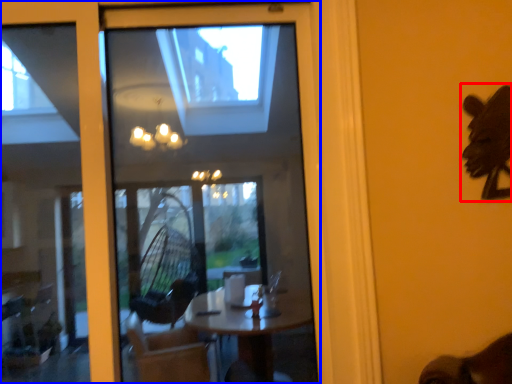
Question: Among these objects, which one is nearest to the camera, animal (highlighted by a red box) or window (highlighted by a blue box)?

Choices:
 (A) animal
 (B) window

Answer: (B)